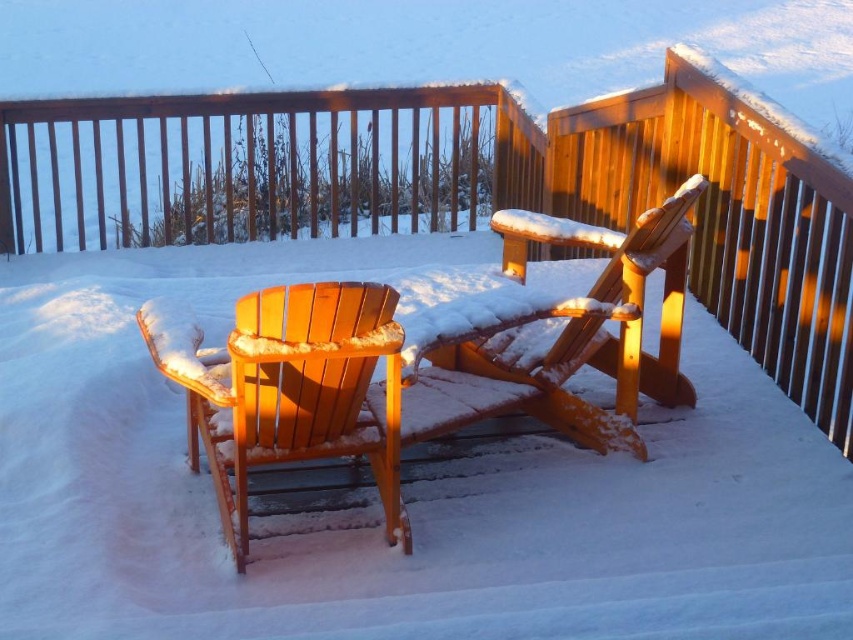
How distant is matte wood chair at left from matte wood chair at center?

matte wood chair at left is 23.27 inches away from matte wood chair at center.

I want to click on matte wood chair at left, so click(287, 388).

Is wooden railing at upper center above matte wood chair at center?

Indeed, wooden railing at upper center is positioned over matte wood chair at center.

Between point (315, 140) and point (425, 376), which one is positioned behind?

The point (315, 140) is more distant.

Locate an element on the screen. Image resolution: width=853 pixels, height=640 pixels. wooden railing at upper center is located at coordinates (260, 164).

Is wooden railing at upper center bigger than matte wood chair at left?

Yes.

You are a GUI agent. You are given a task and a screenshot of the screen. Output one action in this format:
    pyautogui.click(x=<x>, y=<y>)
    Task: Click on the wooden railing at upper center
    This screenshot has height=640, width=853.
    Given the screenshot: What is the action you would take?
    pyautogui.click(x=260, y=164)

Where is `wooden railing at upper center`? This screenshot has width=853, height=640. wooden railing at upper center is located at coordinates (260, 164).